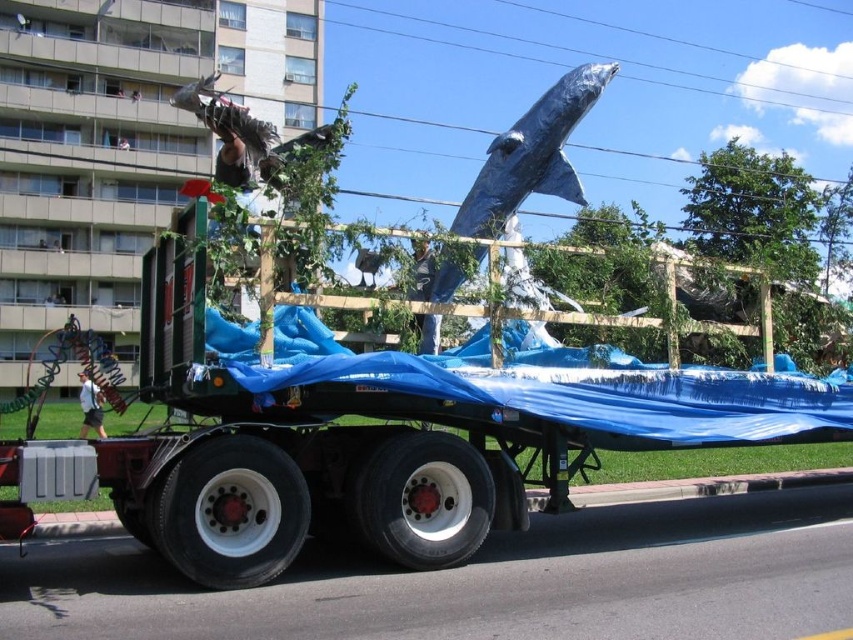
Looking at this image, between green leafy tree at upper right and blue metallic whale at upper center, which one is positioned higher?

green leafy tree at upper right is above.

Can you confirm if green leafy tree at upper right is taller than blue metallic whale at upper center?

Yes.

Is point (744, 160) closer to camera compared to point (561, 172)?

No, it is not.

The image size is (853, 640). Find the location of `green leafy tree at upper right`. green leafy tree at upper right is located at coordinates (753, 211).